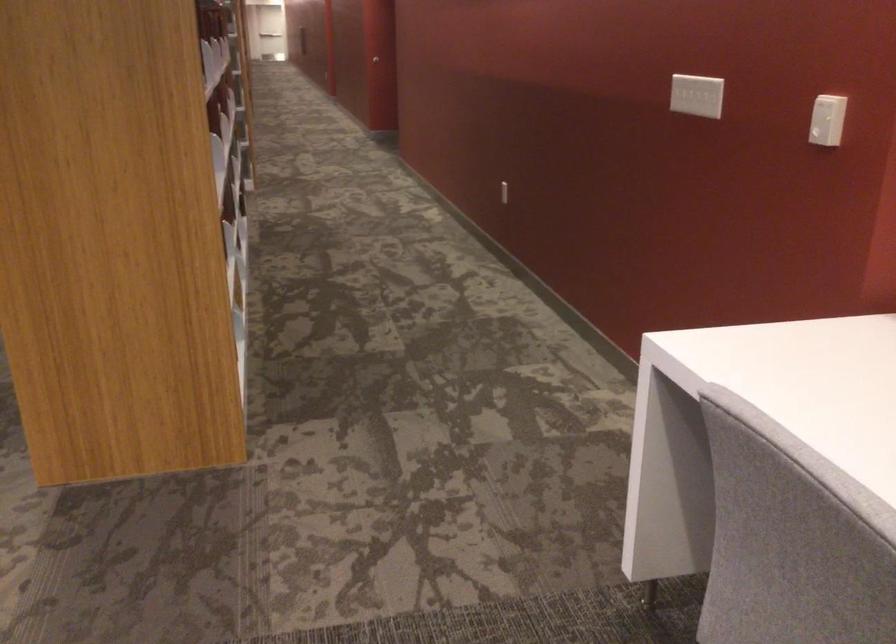
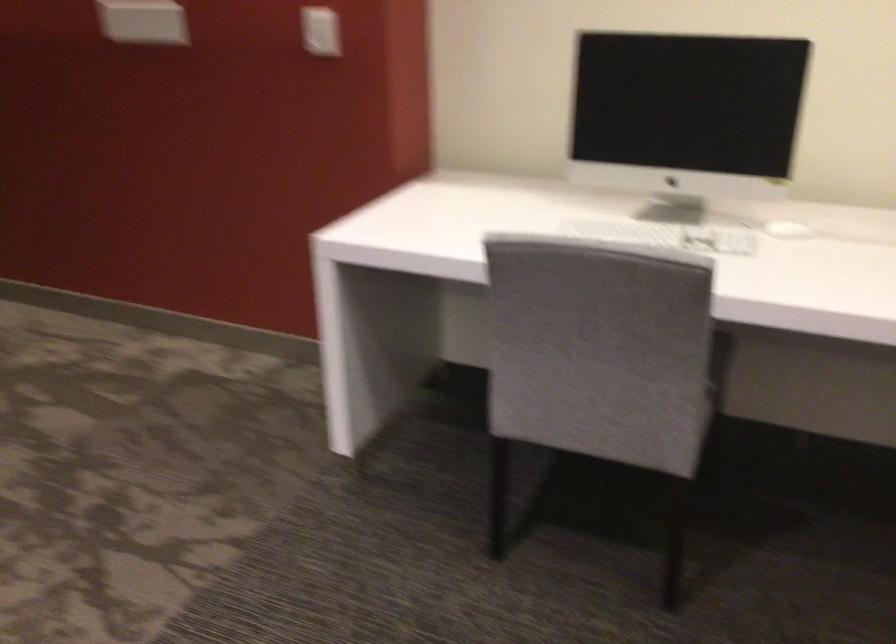
The point at (824, 116) is marked in the first image. Where is the corresponding point in the second image?

(321, 31)